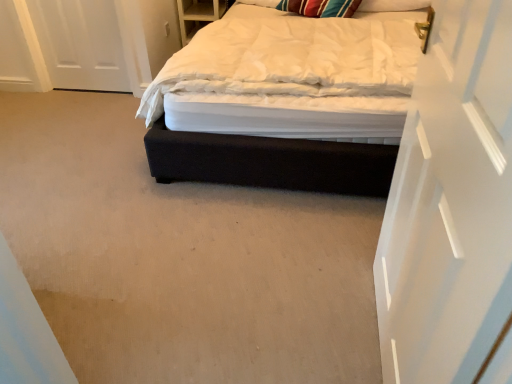
Where is `free area behind white glossy door at upper right`? The width and height of the screenshot is (512, 384). free area behind white glossy door at upper right is located at coordinates (329, 251).